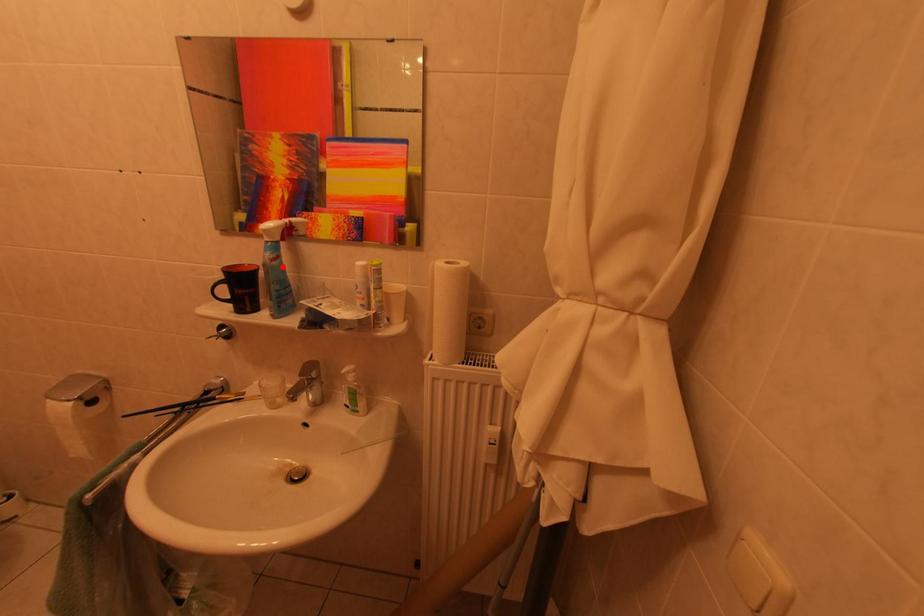
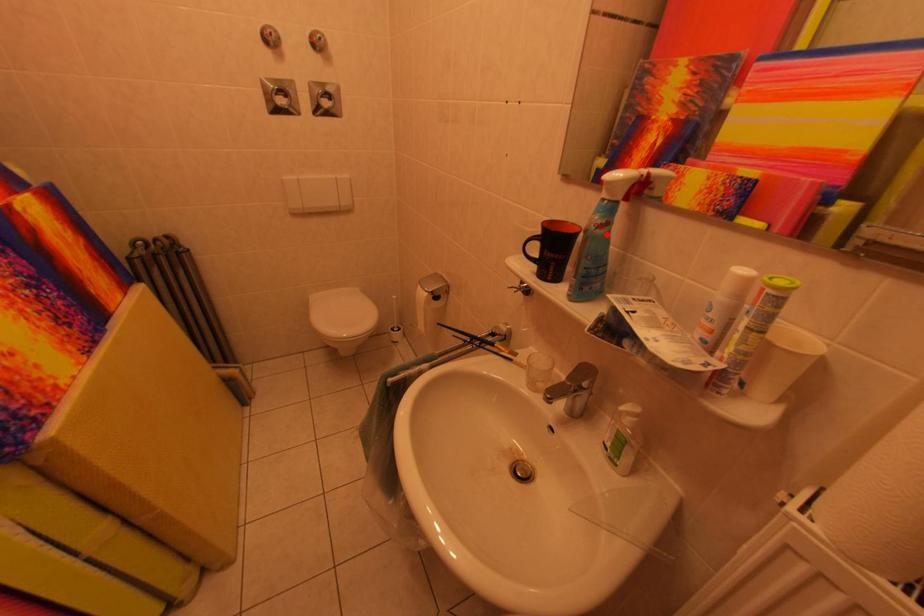
I am providing you with two images of the same scene from different viewpoints. A red point is marked on the first image and another point is marked on the second image. Is the marked point in image1 the same physical position as the marked point in image2?

Yes